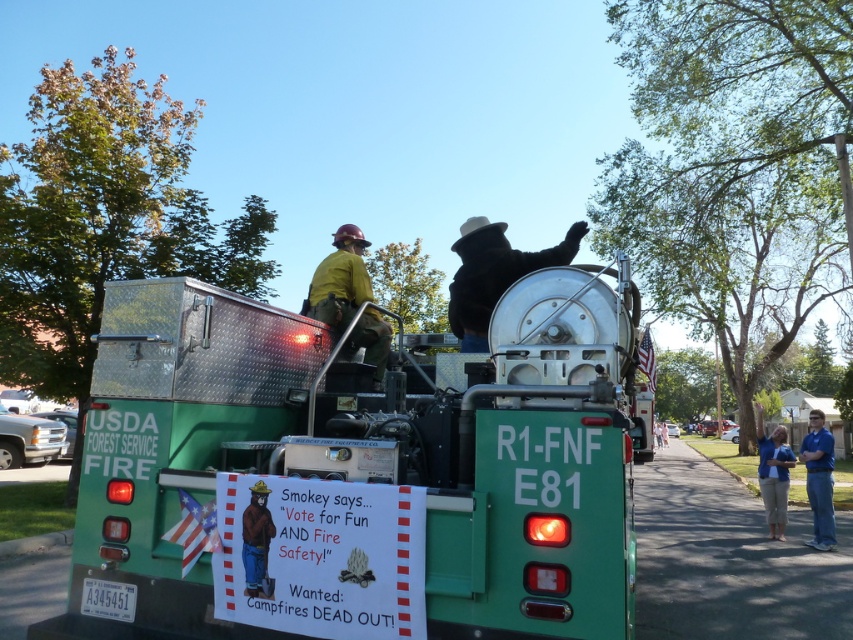
Can you confirm if blue fabric shirt at lower right is shorter than brown paper bear at center?

No.

From the picture: Who is more distant from viewer, [764,476] or [264,538]?

The point [764,476] is behind.

This screenshot has width=853, height=640. Identify the location of blue fabric shirt at lower right. (773, 474).

Can you confirm if yellow hard hat at center is positioned below white plastic license plate at lower left?

Incorrect, yellow hard hat at center is not positioned below white plastic license plate at lower left.

Is point (343, 355) in front of point (94, 602)?

No, (343, 355) is behind (94, 602).

Locate an element on the screen. The width and height of the screenshot is (853, 640). yellow hard hat at center is located at coordinates (339, 280).

Who is more distant from viewer, (370,312) or (819,496)?

Point (819,496)

Does point (344, 316) come closer to viewer compared to point (813, 420)?

Yes, it is in front of point (813, 420).

In order to click on yellow hard hat at center in this screenshot , I will do (339, 280).